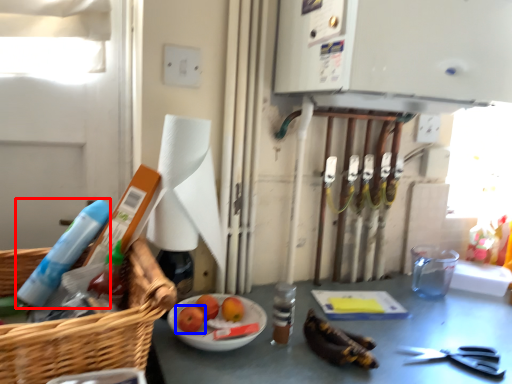
Question: Among these objects, which one is farthest to the camera, cleaning product (highlighted by a red box) or fruit (highlighted by a blue box)?

Choices:
 (A) cleaning product
 (B) fruit

Answer: (B)